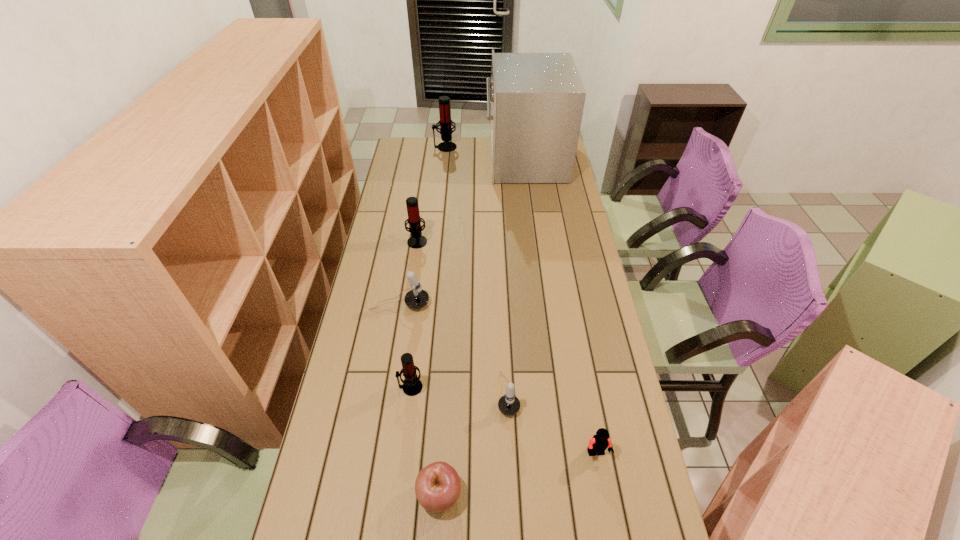
Find the location of a particular element. Image resolution: width=960 pixels, height=540 pixels. black Lego is located at coordinates (600, 442).

Where is `the seventh farthest object`? the seventh farthest object is located at coordinates (600, 442).

Locate an element on the screen. the nearest object is located at coordinates click(x=437, y=487).

Locate an element on the screen. apple is located at coordinates (437, 487).

Identify the location of free location located on the front panel of the toaster oven. This screenshot has height=540, width=960. (430, 159).

Where is `vacant space located 0.200m on the front panel of the toaster oven`? vacant space located 0.200m on the front panel of the toaster oven is located at coordinates (447, 159).

This screenshot has height=540, width=960. I want to click on free space located 0.370m on the front panel of the toaster oven, so click(415, 159).

At what (x,y) coordinates should I click in order to perform the action: click on vacant space located on the right of the farthest microphone. Please return your answer as a coordinate pair (x, y). This screenshot has height=540, width=960. Looking at the image, I should click on (515, 147).

Locate an element on the screen. vacant space situated 0.320m on the right of the second biggest red microphone is located at coordinates (504, 241).

Where is `free location located on the front of the third nearest microphone`? This screenshot has width=960, height=540. free location located on the front of the third nearest microphone is located at coordinates (381, 419).